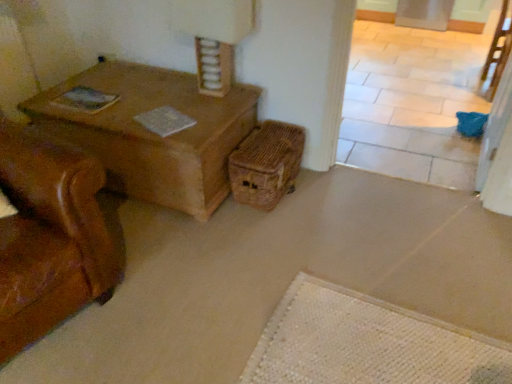
Question: Considering the relative positions of woven brown basket at lower right and brown woven chair at upper right in the image provided, is woven brown basket at lower right to the left or to the right of brown woven chair at upper right?

Choices:
 (A) left
 (B) right

Answer: (A)

Question: From their relative heights in the image, would you say woven brown basket at lower right is taller or shorter than brown woven chair at upper right?

Choices:
 (A) short
 (B) tall

Answer: (A)

Question: Is point (285, 124) positioned closer to the camera than point (507, 43)?

Choices:
 (A) closer
 (B) farther

Answer: (A)

Question: Choose the correct answer: Is brown woven chair at upper right inside woven brown basket at lower right or outside it?

Choices:
 (A) inside
 (B) outside

Answer: (B)

Question: Is brown woven chair at upper right to the left or to the right of woven brown basket at lower right in the image?

Choices:
 (A) right
 (B) left

Answer: (A)

Question: Looking at their shapes, would you say brown woven chair at upper right is wider or thinner than woven brown basket at lower right?

Choices:
 (A) wide
 (B) thin

Answer: (B)

Question: In terms of size, does brown woven chair at upper right appear bigger or smaller than woven brown basket at lower right?

Choices:
 (A) big
 (B) small

Answer: (A)